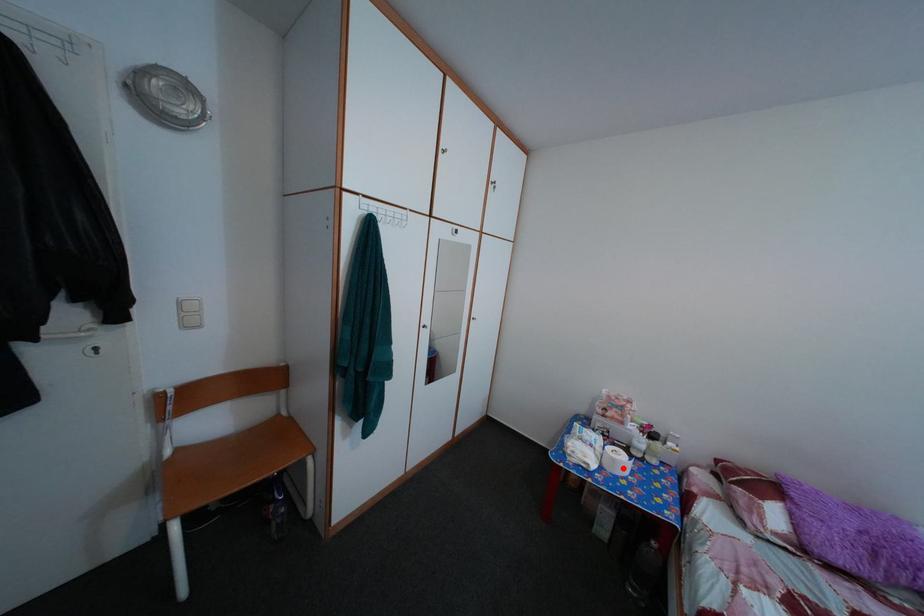
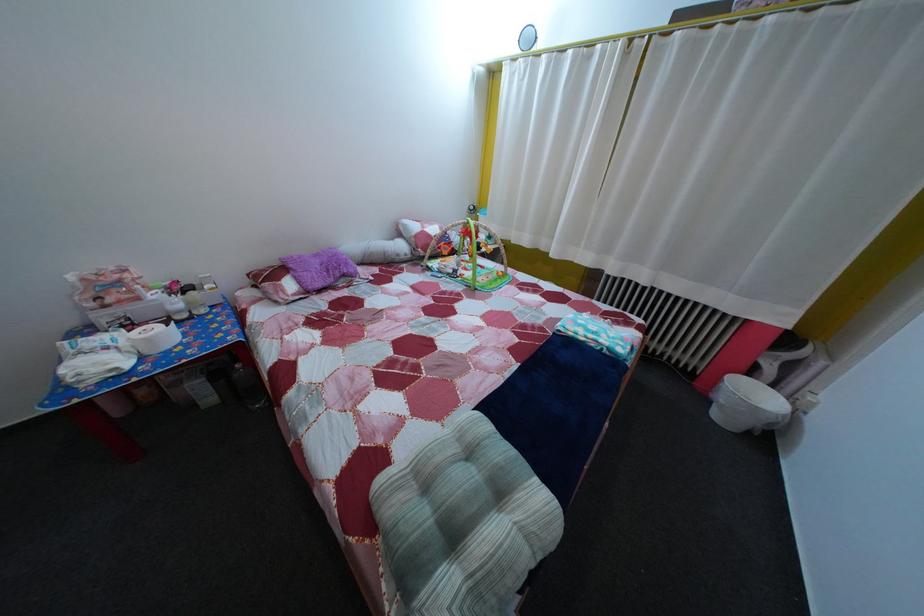
Question: A red point is marked in image1. In image2, is the corresponding 3D point closer to the camera or farther? Reply with the corresponding letter.

Choices:
 (A) The corresponding 3D point is closer.
 (B) The corresponding 3D point is farther.

Answer: (B)